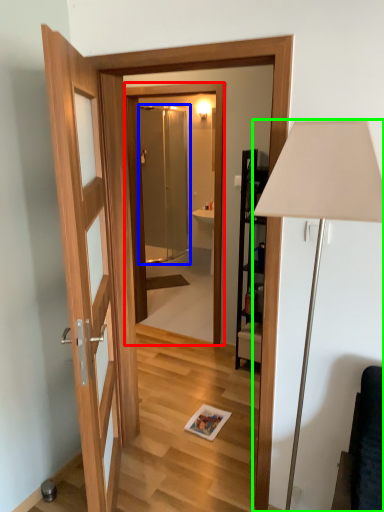
Question: Which is nearer to the mirror (highlighted by a red box)? screen door (highlighted by a blue box) or lamp (highlighted by a green box).

Choices:
 (A) screen door
 (B) lamp

Answer: (A)